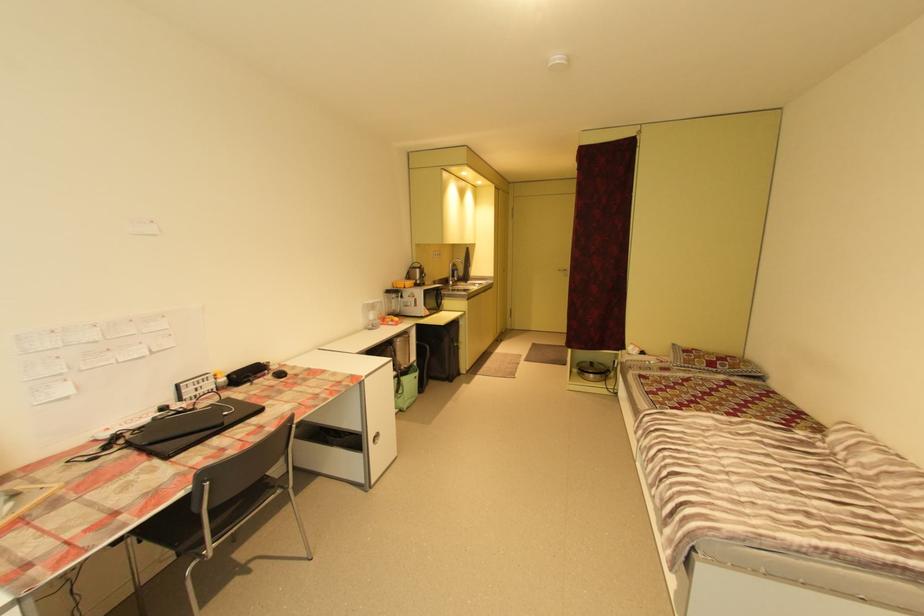
I want to click on transparent water pitcher, so click(371, 313).